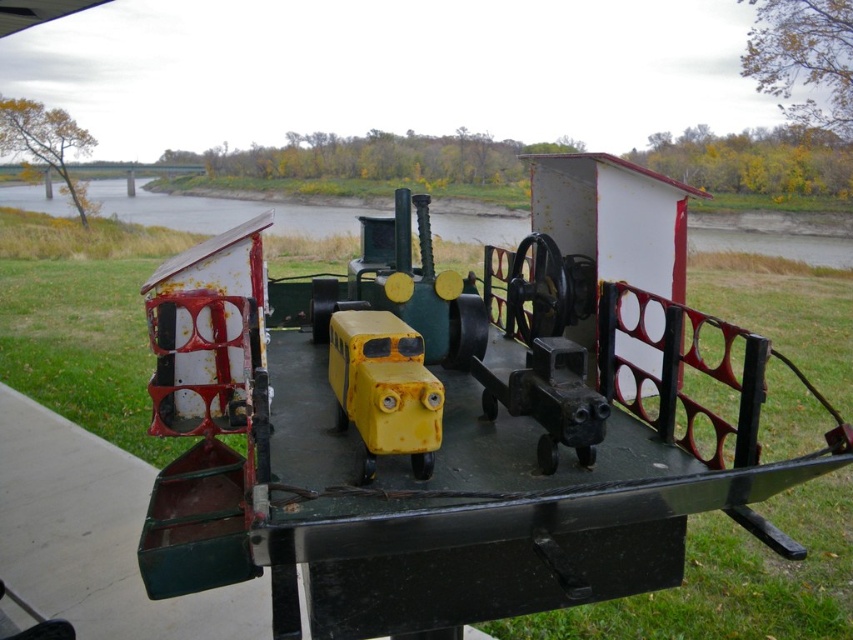
Describe the element at coordinates (453, 417) in the screenshot. I see `rusty metal train at center` at that location.

Which is more to the right, rusty metal train at center or yellow matte toy bus at center?

rusty metal train at center

At what (x,y) coordinates should I click in order to perform the action: click on rusty metal train at center. Please return your answer as a coordinate pair (x, y). This screenshot has width=853, height=640. Looking at the image, I should click on (453, 417).